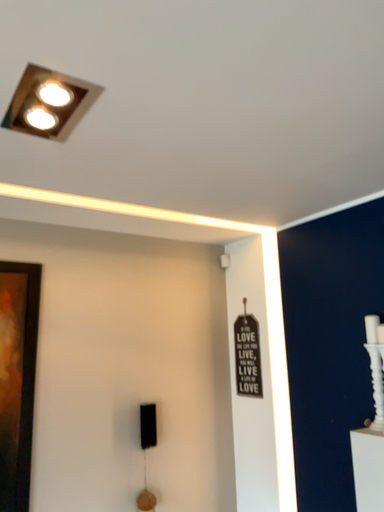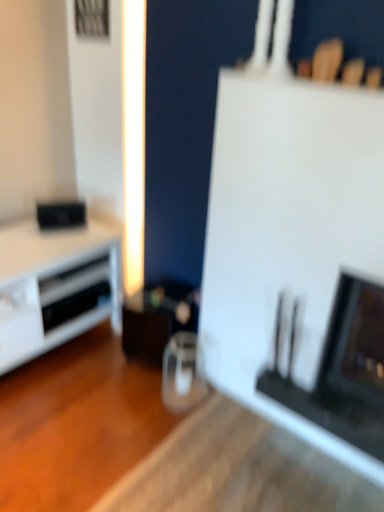
Question: Which way did the camera rotate in the video?

Choices:
 (A) rotated upward
 (B) rotated downward

Answer: (B)